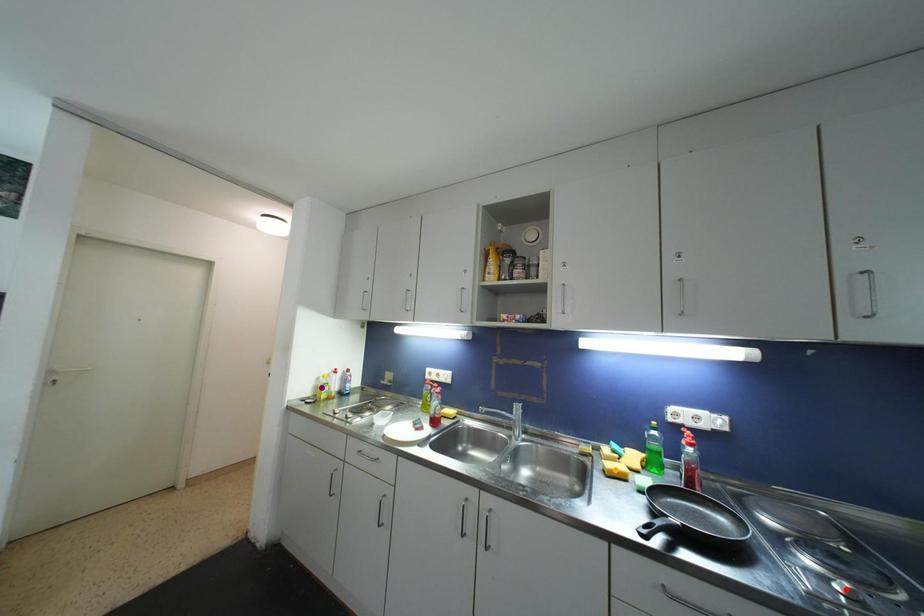
Order these from nearest to farthest:
1. orange point
2. red point
3. purple point

red point → orange point → purple point